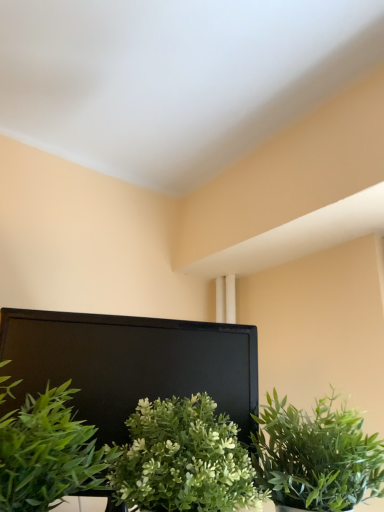
This screenshot has width=384, height=512. What do you see at coordinates (316, 456) in the screenshot?
I see `green leafy plant at center, the 1th houseplant when ordered from right to left` at bounding box center [316, 456].

Find the location of a particular element. green leafy plant at center, which is the 3th houseplant from left to right is located at coordinates (316, 456).

Is green leafy plant at center, the 1th houseplant when ordered from right to left, oriented towards green matte plant at center, the second houseplant viewed from the right?

No, green leafy plant at center, the 1th houseplant when ordered from right to left, is not aimed at green matte plant at center, the second houseplant viewed from the right.

Is green leafy plant at center, which is the 3th houseplant from left to right, smaller than green matte plant at center, the second houseplant viewed from the right?

No, green leafy plant at center, which is the 3th houseplant from left to right, is not smaller than green matte plant at center, the second houseplant viewed from the right.

Between green leafy plant at center, the 1th houseplant when ordered from right to left, and green matte plant at center, the second houseplant in the left-to-right sequence, which one has more height?

green matte plant at center, the second houseplant in the left-to-right sequence, is taller.

Considering the relative sizes of green leafy plant at center, which is the 3th houseplant from left to right, and green leafy plant at lower left, the 3th houseplant viewed from the right, in the image provided, is green leafy plant at center, which is the 3th houseplant from left to right, wider than green leafy plant at lower left, the 3th houseplant viewed from the right,?

Correct, the width of green leafy plant at center, which is the 3th houseplant from left to right, exceeds that of green leafy plant at lower left, the 3th houseplant viewed from the right.

Looking at this image, is green leafy plant at center, the 1th houseplant when ordered from right to left, at the right side of green leafy plant at lower left, the 1th houseplant positioned from the left?

Yes.

In the scene shown: Is the position of green leafy plant at center, the 1th houseplant when ordered from right to left, more distant than that of green leafy plant at lower left, the 3th houseplant viewed from the right?

That is True.

Which is in front, green matte plant at center, the second houseplant in the left-to-right sequence, or green leafy plant at center, the 1th houseplant when ordered from right to left?

green matte plant at center, the second houseplant in the left-to-right sequence.

From the image's perspective, is green matte plant at center, the second houseplant in the left-to-right sequence, located above or below green leafy plant at center, which is the 3th houseplant from left to right?

Clearly, from the image's perspective, green matte plant at center, the second houseplant in the left-to-right sequence, is below green leafy plant at center, which is the 3th houseplant from left to right.

The height and width of the screenshot is (512, 384). Find the location of `houseplant below the green leafy plant at center, which is the 3th houseplant from left to right (from the image's perspective)`. houseplant below the green leafy plant at center, which is the 3th houseplant from left to right (from the image's perspective) is located at coordinates (184, 459).

Considering the relative sizes of green matte plant at center, the second houseplant viewed from the right, and green leafy plant at center, the 1th houseplant when ordered from right to left, in the image provided, is green matte plant at center, the second houseplant viewed from the right, bigger than green leafy plant at center, the 1th houseplant when ordered from right to left,?

Incorrect, green matte plant at center, the second houseplant viewed from the right, is not larger than green leafy plant at center, the 1th houseplant when ordered from right to left.

Which of these two, green leafy plant at lower left, the 1th houseplant positioned from the left, or green matte plant at center, the second houseplant viewed from the right, stands shorter?

green matte plant at center, the second houseplant viewed from the right, is shorter.

How distant is green leafy plant at lower left, the 3th houseplant viewed from the right, from green matte plant at center, the second houseplant in the left-to-right sequence?

3.81 inches.

Is green leafy plant at lower left, the 1th houseplant positioned from the left, facing away from green matte plant at center, the second houseplant viewed from the right?

No, green leafy plant at lower left, the 1th houseplant positioned from the left, is not facing the opposite direction of green matte plant at center, the second houseplant viewed from the right.

From a real-world perspective, is green leafy plant at lower left, the 1th houseplant positioned from the left, on top of green matte plant at center, the second houseplant in the left-to-right sequence?

Yes.

Can you confirm if green matte plant at center, the second houseplant viewed from the right, is taller than green leafy plant at lower left, the 1th houseplant positioned from the left?

In fact, green matte plant at center, the second houseplant viewed from the right, may be shorter than green leafy plant at lower left, the 1th houseplant positioned from the left.

How different are the orientations of green matte plant at center, the second houseplant in the left-to-right sequence, and green leafy plant at lower left, the 3th houseplant viewed from the right, in degrees?

0.00352 degrees.

Are green matte plant at center, the second houseplant in the left-to-right sequence, and green leafy plant at lower left, the 1th houseplant positioned from the left, beside each other?

Yes, green matte plant at center, the second houseplant in the left-to-right sequence, is with green leafy plant at lower left, the 1th houseplant positioned from the left.

From a real-world perspective, is green matte plant at center, the second houseplant viewed from the right, physically below green leafy plant at lower left, the 1th houseplant positioned from the left?

Correct, in the physical world, green matte plant at center, the second houseplant viewed from the right, is lower than green leafy plant at lower left, the 1th houseplant positioned from the left.

Considering the positions of point (29, 502) and point (355, 466), is point (29, 502) closer or farther from the camera than point (355, 466)?

Point (29, 502) appears to be closer to the viewer than point (355, 466).

In the scene shown: Which object is more forward, green leafy plant at lower left, the 1th houseplant positioned from the left, or green leafy plant at center, which is the 3th houseplant from left to right?

green leafy plant at lower left, the 1th houseplant positioned from the left, is closer to the camera.

From a real-world perspective, is green leafy plant at lower left, the 1th houseplant positioned from the left, positioned above or below green leafy plant at center, which is the 3th houseplant from left to right?

In terms of real-world spatial position, green leafy plant at lower left, the 1th houseplant positioned from the left, is below green leafy plant at center, which is the 3th houseplant from left to right.

Is green leafy plant at lower left, the 3th houseplant viewed from the right, to the right of green leafy plant at center, which is the 3th houseplant from left to right, from the viewer's perspective?

Incorrect, green leafy plant at lower left, the 3th houseplant viewed from the right, is not on the right side of green leafy plant at center, which is the 3th houseplant from left to right.

Find the location of `the 1st houseplant above when counting from the green matte plant at center, the second houseplant viewed from the right (from the image's perspective)`. the 1st houseplant above when counting from the green matte plant at center, the second houseplant viewed from the right (from the image's perspective) is located at coordinates point(316,456).

This screenshot has width=384, height=512. What are the coordinates of `houseplant that is the 2nd object located in front of the green leafy plant at center, the 1th houseplant when ordered from right to left` in the screenshot? It's located at click(48, 453).

Consider the image. Which object lies nearer to the anchor point green matte plant at center, the second houseplant in the left-to-right sequence, green leafy plant at lower left, the 1th houseplant positioned from the left, or green leafy plant at center, the 1th houseplant when ordered from right to left?

Based on the image, green leafy plant at lower left, the 1th houseplant positioned from the left, appears to be nearer to green matte plant at center, the second houseplant in the left-to-right sequence.

Based on their spatial positions, is green leafy plant at center, which is the 3th houseplant from left to right, or green leafy plant at lower left, the 1th houseplant positioned from the left, closer to green matte plant at center, the second houseplant in the left-to-right sequence?

Among the two, green leafy plant at lower left, the 1th houseplant positioned from the left, is located nearer to green matte plant at center, the second houseplant in the left-to-right sequence.

Which object lies nearer to the anchor point green leafy plant at lower left, the 3th houseplant viewed from the right, green leafy plant at center, the 1th houseplant when ordered from right to left, or green matte plant at center, the second houseplant viewed from the right?

green matte plant at center, the second houseplant viewed from the right.

Based on their spatial positions, is green leafy plant at lower left, the 3th houseplant viewed from the right, or green matte plant at center, the second houseplant viewed from the right, closer to green leafy plant at center, the 1th houseplant when ordered from right to left?

green matte plant at center, the second houseplant viewed from the right.

Looking at the image, which one is located closer to green leafy plant at center, the 1th houseplant when ordered from right to left, green matte plant at center, the second houseplant in the left-to-right sequence, or green leafy plant at lower left, the 3th houseplant viewed from the right?

The object closer to green leafy plant at center, the 1th houseplant when ordered from right to left, is green matte plant at center, the second houseplant in the left-to-right sequence.

Estimate the real-world distances between objects in this image. Which object is further from green leafy plant at lower left, the 1th houseplant positioned from the left, green matte plant at center, the second houseplant in the left-to-right sequence, or green leafy plant at center, which is the 3th houseplant from left to right?

green leafy plant at center, which is the 3th houseplant from left to right.

The height and width of the screenshot is (512, 384). Identify the location of houseplant situated between green leafy plant at lower left, the 1th houseplant positioned from the left, and green leafy plant at center, which is the 3th houseplant from left to right, from left to right. (184, 459).